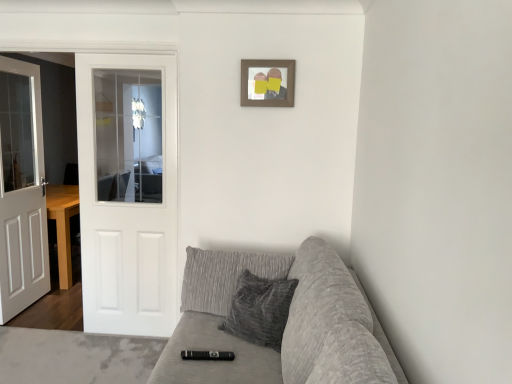
Question: Is textured gray couch at lower right to the left or to the right of black plastic remote at center in the image?

Choices:
 (A) right
 (B) left

Answer: (A)

Question: Is textured gray couch at lower right inside the boundaries of black plastic remote at center, or outside?

Choices:
 (A) outside
 (B) inside

Answer: (A)

Question: Considering the real-world distances, which object is closest to the white wooden door at left, which is counted as the first door, starting from the left?

Choices:
 (A) black plastic remote at center
 (B) white glossy door at left, the 2th door positioned from the left
 (C) wooden picture frame at upper center
 (D) textured gray couch at lower right

Answer: (B)

Question: Which object is the farthest from the textured gray couch at lower right?

Choices:
 (A) black plastic remote at center
 (B) white wooden door at left, marked as the 2th door in a right-to-left arrangement
 (C) white glossy door at left, the 2th door positioned from the left
 (D) wooden picture frame at upper center

Answer: (C)